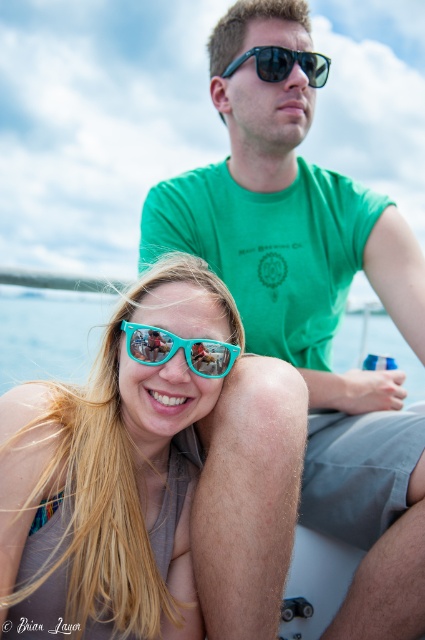
Between green matte t-shirt at upper center and teal plastic goggles at center, which one appears on the right side from the viewer's perspective?

From the viewer's perspective, green matte t-shirt at upper center appears more on the right side.

Does green matte t-shirt at upper center come in front of teal plastic goggles at center?

No.

Identify the location of green matte t-shirt at upper center. Image resolution: width=425 pixels, height=640 pixels. (311, 305).

The image size is (425, 640). Identify the location of teal plastic sunglasses at center. pyautogui.click(x=115, y=468).

This screenshot has height=640, width=425. I want to click on teal plastic sunglasses at center, so click(x=115, y=468).

Does green matte t-shirt at upper center have a lesser height compared to sunglasses at upper center?

Incorrect, green matte t-shirt at upper center's height does not fall short of sunglasses at upper center's.

Is green matte t-shirt at upper center below sunglasses at upper center?

Correct, green matte t-shirt at upper center is located below sunglasses at upper center.

Between point (176, 216) and point (308, 81), which one is positioned behind?

The point (176, 216) is more distant.

This screenshot has height=640, width=425. I want to click on green matte t-shirt at upper center, so click(311, 305).